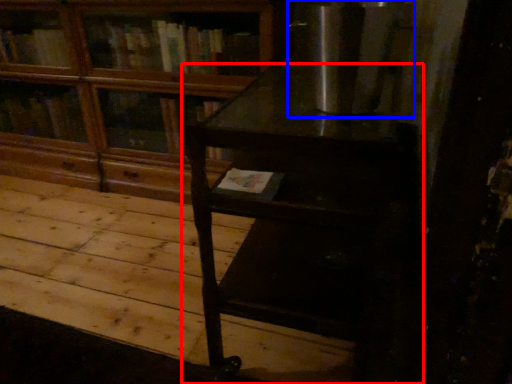
Question: Among these objects, which one is farthest to the camera, table (highlighted by a red box) or appliance (highlighted by a blue box)?

Choices:
 (A) table
 (B) appliance

Answer: (B)